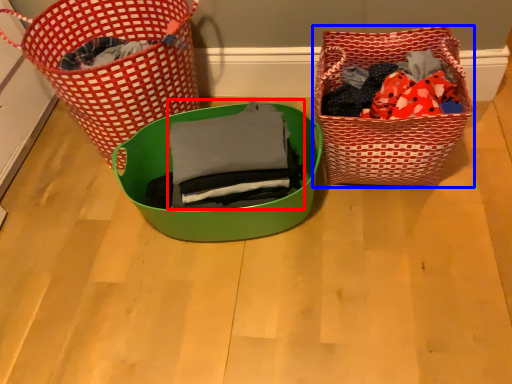
Question: Which of the following is the farthest to the observer, clothing (highlighted by a red box) or picnic basket (highlighted by a blue box)?

Choices:
 (A) clothing
 (B) picnic basket

Answer: (B)